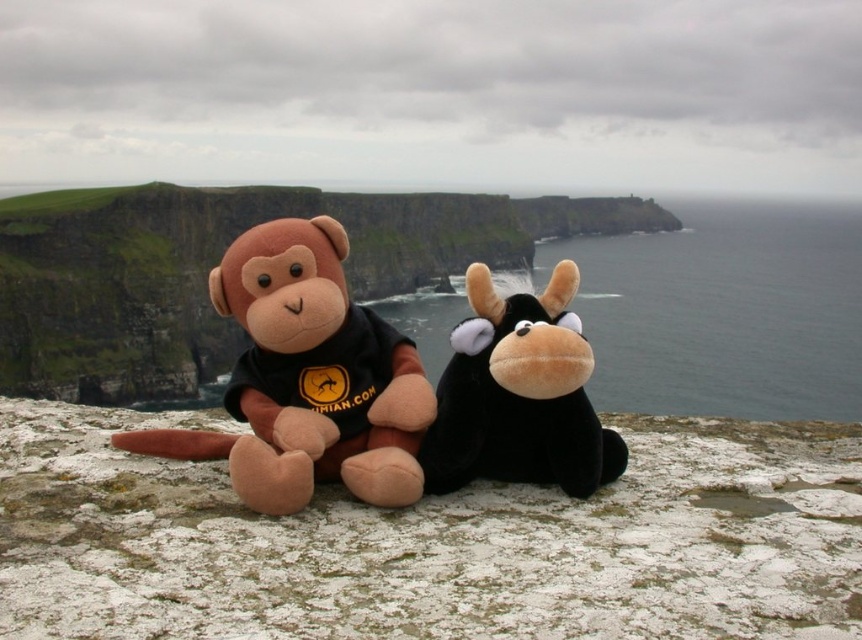
Question: Which object is positioned closest to the brown plush monkey at center?

Choices:
 (A) green grass cliff at center
 (B) brown plush monkey at left

Answer: (B)

Question: Is green grass cliff at center smaller than black plush cow at center?

Choices:
 (A) yes
 (B) no

Answer: (B)

Question: Which of the following is the farthest from the observer?

Choices:
 (A) black plush cow at center
 (B) brown plush monkey at center
 (C) green grass cliff at center
 (D) brown plush monkey at left

Answer: (C)

Question: Which of these objects is positioned closest to the green grass cliff at center?

Choices:
 (A) black plush cow at center
 (B) brown plush monkey at left

Answer: (B)

Question: In this image, where is brown plush monkey at center located relative to black plush cow at center?

Choices:
 (A) right
 (B) left

Answer: (B)

Question: From the image, what is the correct spatial relationship of green grass cliff at center in relation to black plush cow at center?

Choices:
 (A) above
 (B) below

Answer: (A)